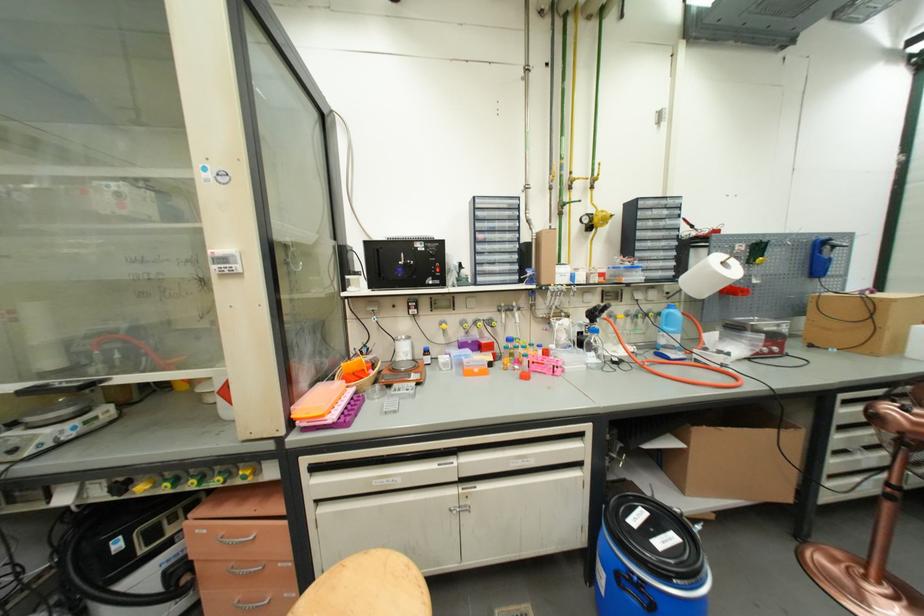
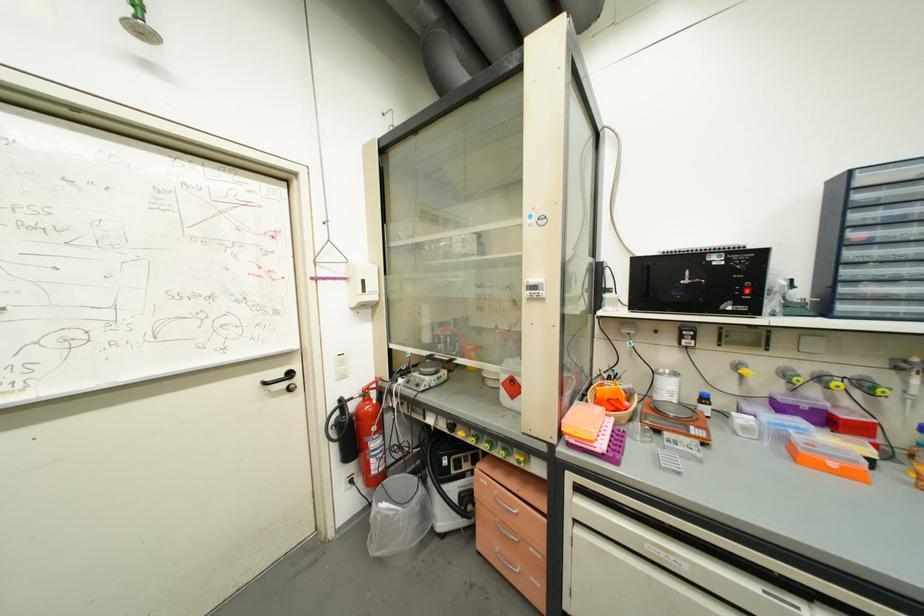
Locate, in the second image, the point that corresponds to pixel 441 268 in the first image.

(748, 288)